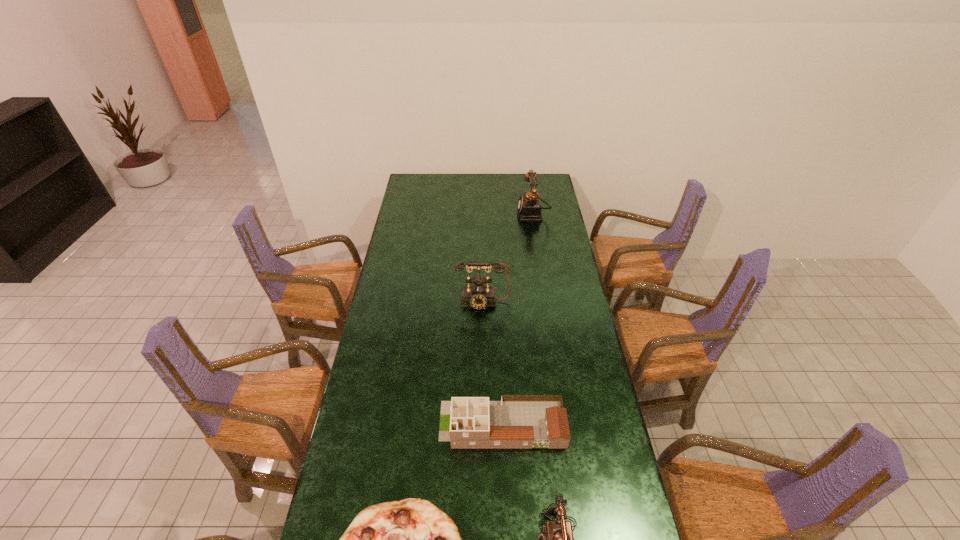
Find the location of a particular element. the farthest object is located at coordinates (529, 207).

You are a GUI agent. You are given a task and a screenshot of the screen. Output one action in this format:
    pyautogui.click(x=<x>, y=<y>)
    Task: Click on the second farthest object
    The height and width of the screenshot is (540, 960).
    Given the screenshot: What is the action you would take?
    pyautogui.click(x=478, y=295)

Where is `the second farthest telephone`? The width and height of the screenshot is (960, 540). the second farthest telephone is located at coordinates (478, 295).

Find the location of a particular element. This screenshot has width=960, height=540. the third nearest object is located at coordinates (517, 421).

Locate an element on the screen. Image resolution: width=960 pixels, height=540 pixels. blank space located on the front of the farthest telephone at the rotary dial is located at coordinates [x=494, y=214].

Find the location of a particular element. The height and width of the screenshot is (540, 960). free space located on the front of the farthest telephone at the rotary dial is located at coordinates (x=508, y=214).

The image size is (960, 540). Find the location of `vacant space located 0.310m on the front of the farthest telephone at the rotary dial`. vacant space located 0.310m on the front of the farthest telephone at the rotary dial is located at coordinates (459, 214).

Identify the location of blank space located 0.160m on the dial of the second farthest telephone. (483, 340).

In order to click on vacant area located at the main entrance of the dollhouse in this screenshot , I will do `click(361, 424)`.

Where is `vacant space located at the main entrance of the dollhouse`? The image size is (960, 540). vacant space located at the main entrance of the dollhouse is located at coordinates (352, 424).